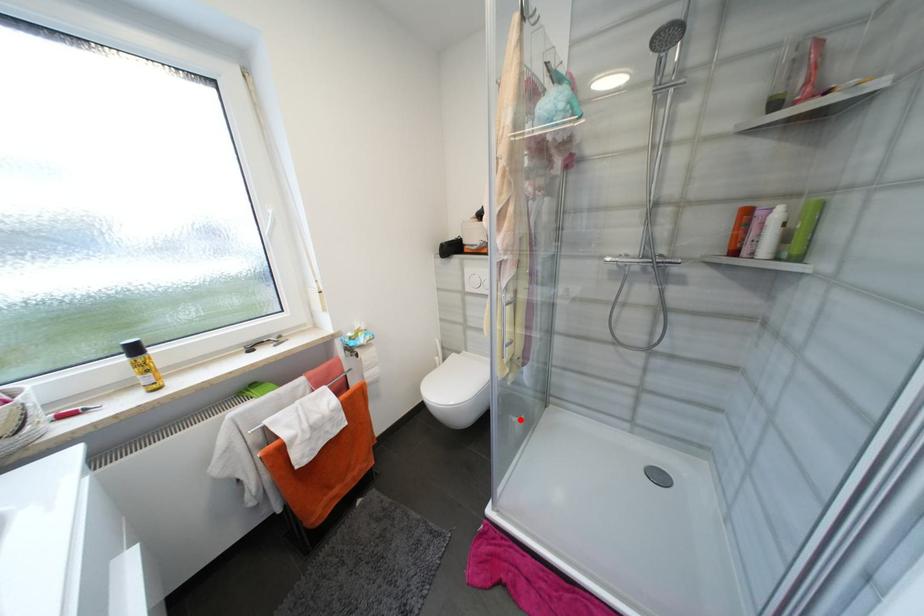
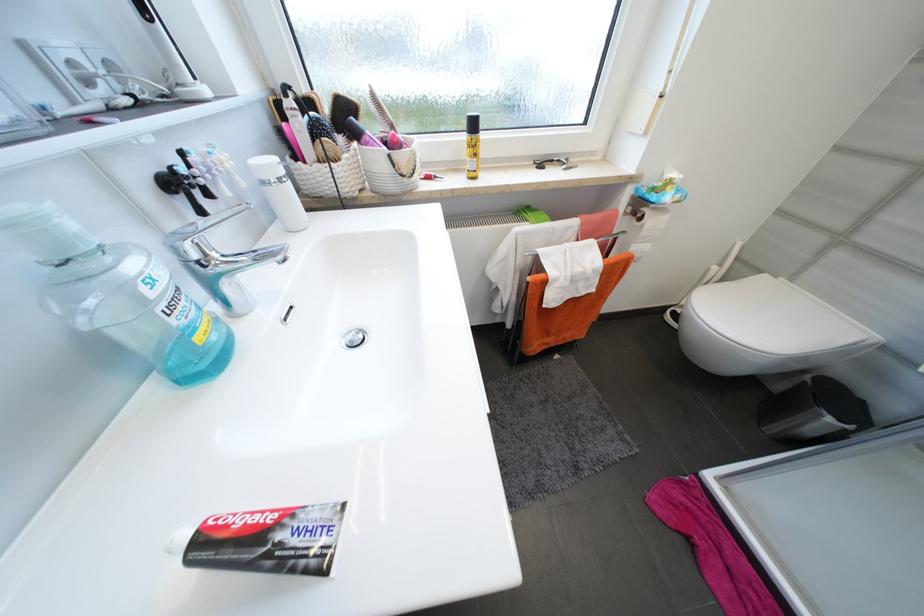
In the second image, find the point that corresponds to the highlighted location in the first image.

(834, 421)